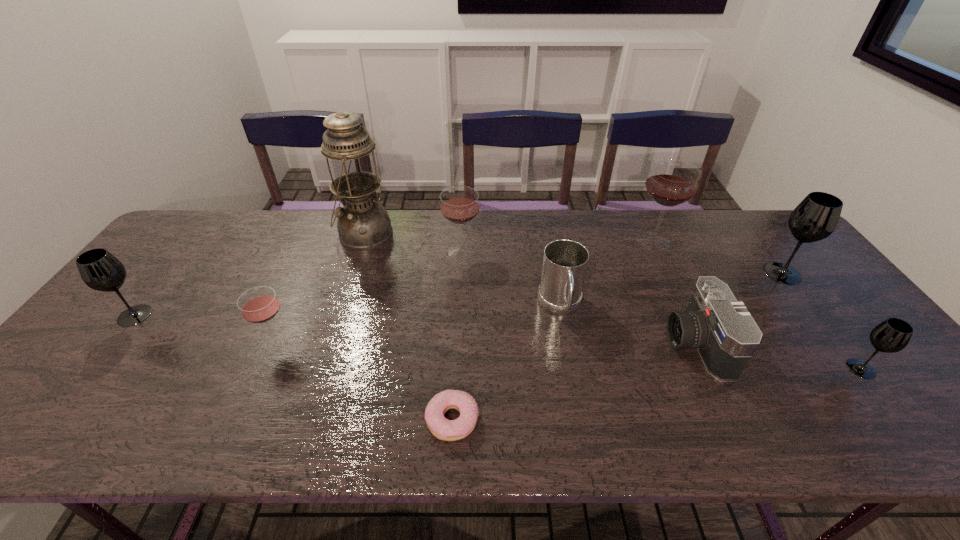
This screenshot has width=960, height=540. Find the location of `free space between the farthest gray wineglass and the smallest red wineglass`. free space between the farthest gray wineglass and the smallest red wineglass is located at coordinates click(529, 308).

You are a GUI agent. You are given a task and a screenshot of the screen. Output one action in this format:
    pyautogui.click(x=<x>, y=<y>)
    Task: Click on the blank region between the tallest object and the second biggest red wineglass
    The width and height of the screenshot is (960, 540).
    Given the screenshot: What is the action you would take?
    pyautogui.click(x=413, y=243)

Find the location of a particular element. The image size is (960, 540). vacant area between the farthest gray wineglass and the leftmost red wineglass is located at coordinates (529, 308).

Where is `vacant area that lies between the shortest object and the mug`? This screenshot has width=960, height=540. vacant area that lies between the shortest object and the mug is located at coordinates (506, 363).

Where is `empty space between the shortest object and the leftmost gray wineglass`? The image size is (960, 540). empty space between the shortest object and the leftmost gray wineglass is located at coordinates (294, 367).

Where is `vacant area between the camera and the biggest red wineglass`? The height and width of the screenshot is (540, 960). vacant area between the camera and the biggest red wineglass is located at coordinates (675, 292).

This screenshot has height=540, width=960. I want to click on the closest object to the leftmost wineglass, so click(258, 305).

Where is `object that is the third closest to the gray mug`? This screenshot has width=960, height=540. object that is the third closest to the gray mug is located at coordinates (671, 182).

Locate which wineglass ranks fifth in proximity to the farthest gray wineglass. Please provide its 2D coordinates. Your answer should be formatted as a tuple, i.e. [(x, y)], where the tuple contains the x and y coordinates of a point satisfying the conditions above.

[(100, 270)]

Identify the location of wineglass that can be found as the fourth closest to the leftmost wineglass. The image size is (960, 540). (816, 217).